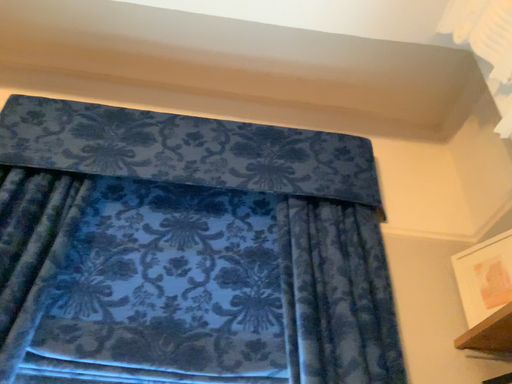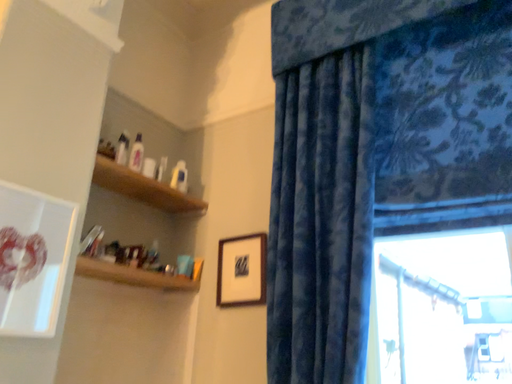
Question: How did the camera likely rotate when shooting the video?

Choices:
 (A) rotated downward
 (B) rotated upward

Answer: (A)